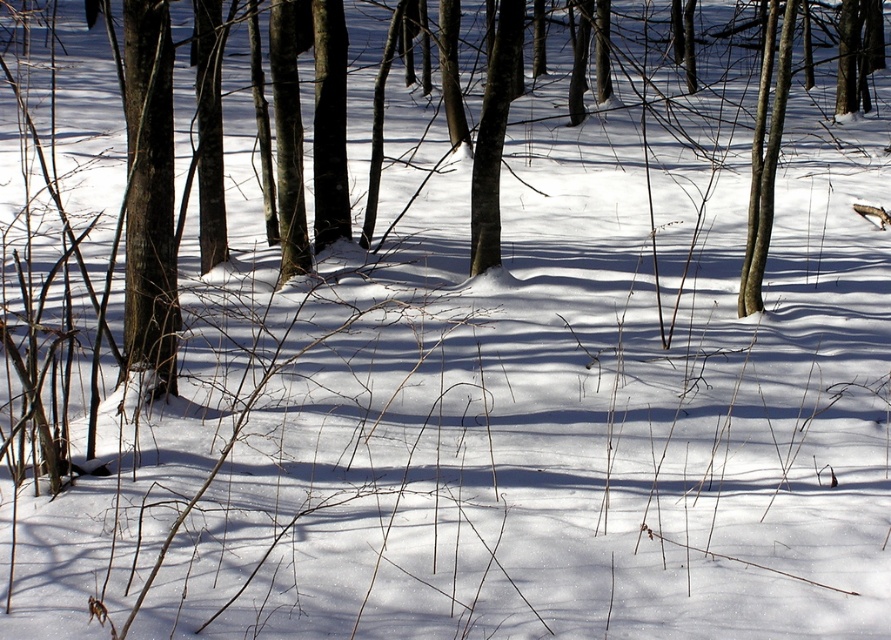
Which of these two, smooth bark tree at left or smooth bark tree at center, stands shorter?

smooth bark tree at center

Who is higher up, smooth bark tree at left or smooth bark tree at center?

Positioned higher is smooth bark tree at center.

The width and height of the screenshot is (891, 640). Find the location of `smooth bark tree at left`. smooth bark tree at left is located at coordinates (149, 195).

Which of these two, smooth bark tree at center or smooth bark tree at upper right, stands shorter?

With less height is smooth bark tree at center.

Can you confirm if smooth bark tree at center is positioned below smooth bark tree at upper right?

Actually, smooth bark tree at center is above smooth bark tree at upper right.

Does point (501, 99) lie behind point (767, 228)?

Yes, point (501, 99) is behind point (767, 228).

Where is `smooth bark tree at center`? This screenshot has width=891, height=640. smooth bark tree at center is located at coordinates (493, 138).

How much distance is there between smooth bark tree at left and smooth bark tree at upper right?

smooth bark tree at left and smooth bark tree at upper right are 3.09 meters apart.

Measure the distance between smooth bark tree at left and smooth bark tree at upper right.

smooth bark tree at left is 3.09 meters from smooth bark tree at upper right.

Is point (169, 74) farther from viewer compared to point (745, 243)?

No, it is in front of (745, 243).

Locate an element on the screen. This screenshot has height=640, width=891. smooth bark tree at left is located at coordinates (149, 195).